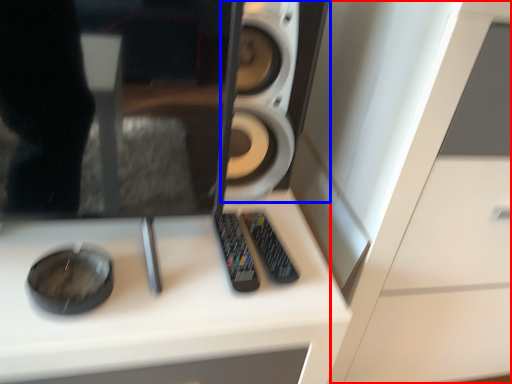
Question: Which object is closer to the camera taking this photo, dresser (highlighted by a red box) or speaker (highlighted by a blue box)?

Choices:
 (A) dresser
 (B) speaker

Answer: (A)